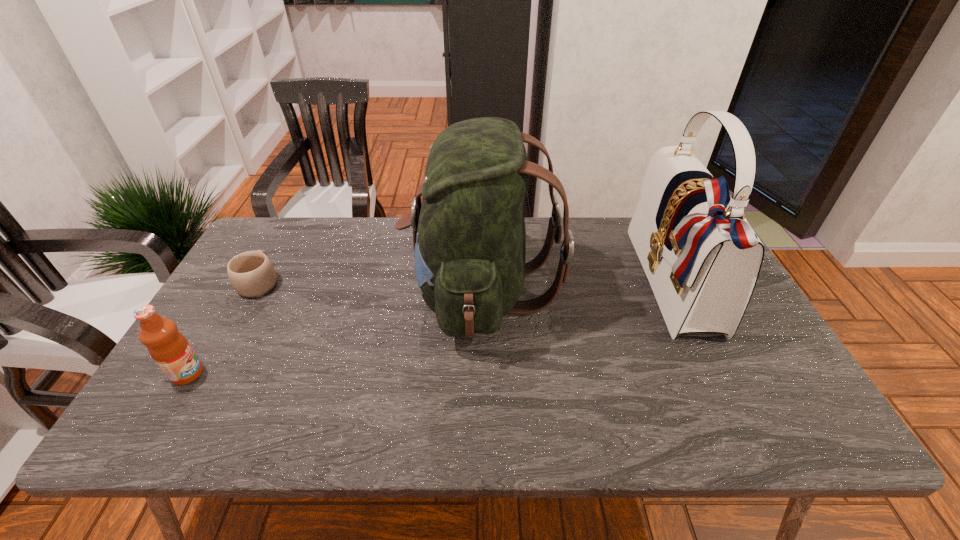
Locate an element on the screen. The image size is (960, 540). vacant space located on the front label of the fruit juice is located at coordinates (371, 374).

This screenshot has width=960, height=540. In order to click on vacant space located 0.220m on the side of the shortest object with the handle in this screenshot , I will do `click(292, 224)`.

You are a GUI agent. You are given a task and a screenshot of the screen. Output one action in this format:
    pyautogui.click(x=<x>, y=<y>)
    Task: Click on the vacant region located 0.090m on the side of the shortest object with the handle
    Image resolution: width=960 pixels, height=540 pixels.
    Given the screenshot: What is the action you would take?
    pyautogui.click(x=278, y=247)

Identify the location of vacant position located on the side of the shortest object with the handle. This screenshot has width=960, height=540. (282, 241).

Locate an element on the screen. Image resolution: width=960 pixels, height=540 pixels. satchel positioned at the far edge is located at coordinates (702, 258).

Identify the location of backpack at the far edge. (469, 236).

Find the location of a particular element. The width and height of the screenshot is (960, 540). fruit juice present at the left edge is located at coordinates (168, 347).

Where is `mug positioned at the left edge`? This screenshot has width=960, height=540. mug positioned at the left edge is located at coordinates (252, 274).

In order to click on object located in the right edge section of the desktop in this screenshot , I will do `click(702, 258)`.

The image size is (960, 540). Identify the location of object that is at the far right corner. (702, 258).